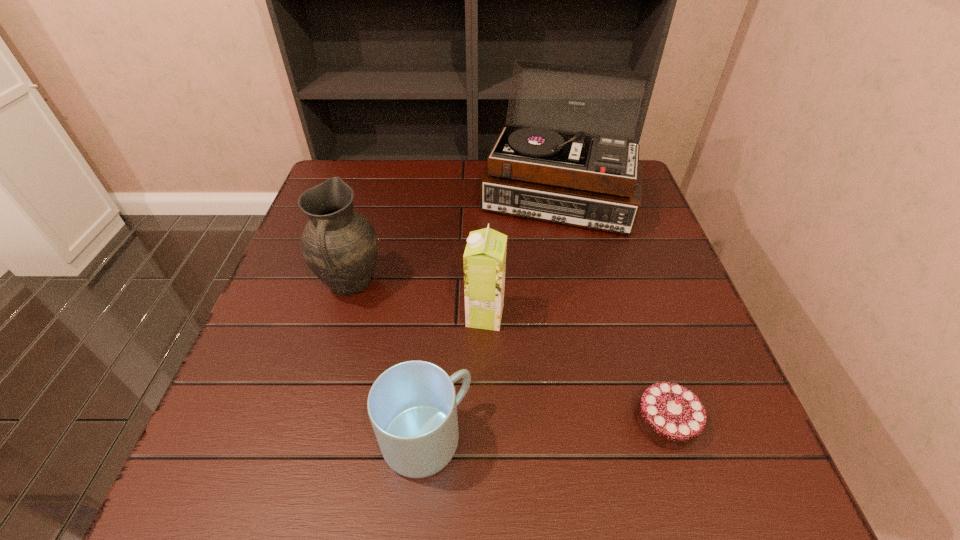
Where is `object that stands as the third closest to the chocolate cake`? object that stands as the third closest to the chocolate cake is located at coordinates (545, 165).

Identify the location of free location that satisfies the following two spatial constraints: 1. on the side of the leftmost object with the handle; 2. on the right side of the second shortest object. This screenshot has width=960, height=540. (306, 439).

You are a GUI agent. You are given a task and a screenshot of the screen. Output one action in this format:
    pyautogui.click(x=<x>, y=<y>)
    Task: Click on the blank space that satisfies the following two spatial constraints: 1. on the side of the mug with the handle; 2. on the left side of the pitcher
    The height and width of the screenshot is (540, 960).
    Given the screenshot: What is the action you would take?
    306,439

Where is `vacant space that satisfies the following two spatial constraints: 1. on the side of the pitcher with the handle; 2. on the left side of the soya milk`? Image resolution: width=960 pixels, height=540 pixels. vacant space that satisfies the following two spatial constraints: 1. on the side of the pitcher with the handle; 2. on the left side of the soya milk is located at coordinates (342, 316).

Find the location of a particular element. Image resolution: width=960 pixels, height=540 pixels. vacant area that satisfies the following two spatial constraints: 1. on the side of the pitcher with the handle; 2. on the right side of the soya milk is located at coordinates (342, 316).

You are a GUI agent. You are given a task and a screenshot of the screen. Output one action in this format:
    pyautogui.click(x=<x>, y=<y>)
    Task: Click on the free location that satisfies the following two spatial constraints: 1. on the back side of the record player; 2. on the left side of the soya milk
    
    Given the screenshot: What is the action you would take?
    pyautogui.click(x=484, y=195)

The width and height of the screenshot is (960, 540). In order to click on vacant position in the image that satisfies the following two spatial constraints: 1. on the side of the pitcher with the handle; 2. on the left side of the shortest object in this screenshot , I will do `click(311, 421)`.

Locate an element on the screen. free space that satisfies the following two spatial constraints: 1. on the side of the leftmost object with the handle; 2. on the left side of the chocolate cake is located at coordinates (311, 421).